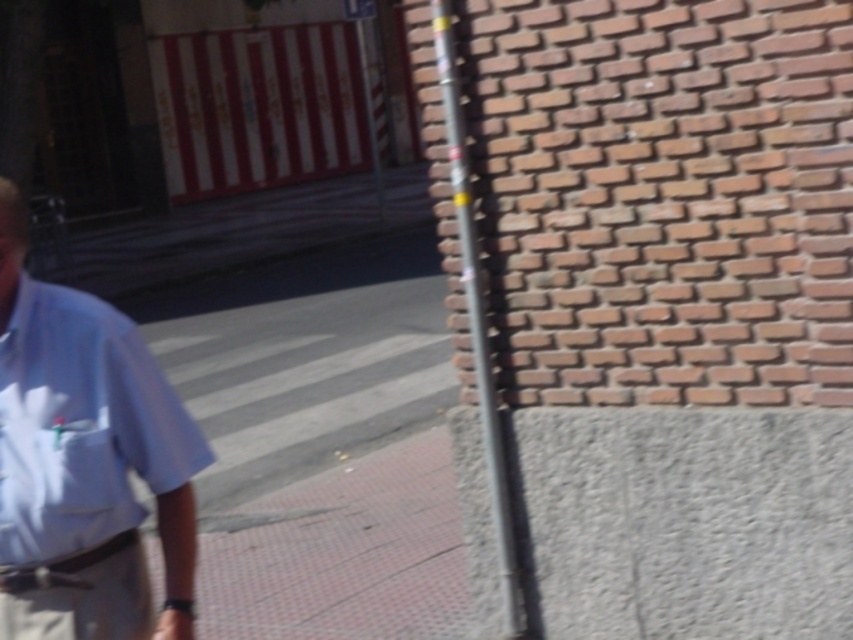
Question: Can you confirm if light blue shirt at center is smaller than white fabric pocket at lower left?

Choices:
 (A) yes
 (B) no

Answer: (B)

Question: Which point is farther from the camera taking this photo?

Choices:
 (A) (451, 65)
 (B) (357, 16)
 (C) (137, 515)
 (D) (93, 470)

Answer: (B)

Question: Which of the following is the closest to the observer?

Choices:
 (A) (355, 19)
 (B) (126, 573)
 (C) (434, 13)

Answer: (B)

Question: Considering the real-world distances, which object is farthest from the light blue shirt at center?

Choices:
 (A) metallic reflective sign at upper center
 (B) white fabric pocket at lower left
 (C) metallic silver pole at center

Answer: (A)

Question: Can you confirm if metallic silver pole at center is thinner than white fabric pocket at lower left?

Choices:
 (A) no
 (B) yes

Answer: (A)

Question: Is light blue shirt at center thinner than metallic reflective sign at upper center?

Choices:
 (A) yes
 (B) no

Answer: (A)